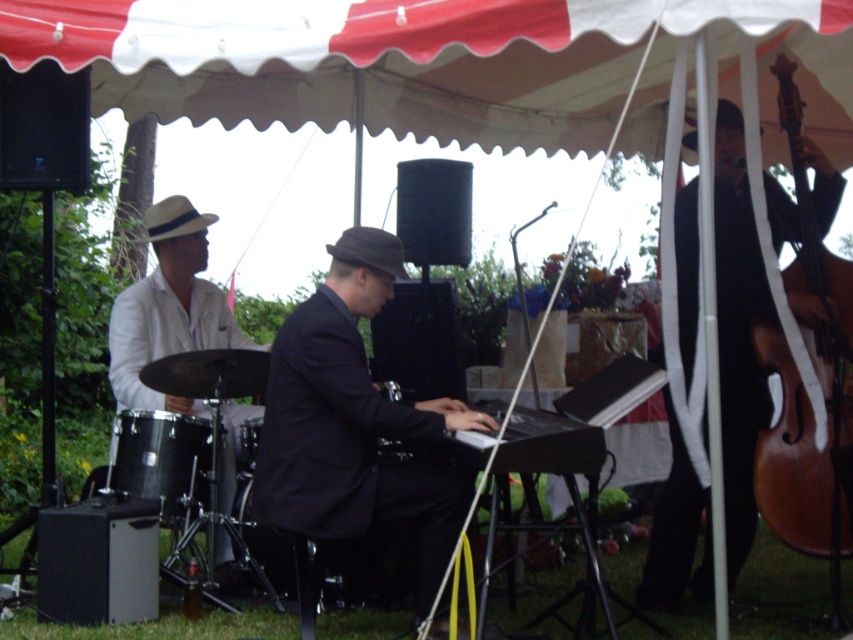
Consider the image. Is white matte suit at left shorter than black drum at lower left?

In fact, white matte suit at left may be taller than black drum at lower left.

Does point (202, 321) come in front of point (283, 532)?

No, it is behind (283, 532).

Between point (196, 259) and point (241, 499), which one is positioned behind?

Positioned behind is point (196, 259).

Locate an element on the screen. The width and height of the screenshot is (853, 640). white matte suit at left is located at coordinates (169, 308).

Is beige felt fedora at left smaller than black drum at center?

Incorrect, beige felt fedora at left is not smaller in size than black drum at center.

Who is more forward, [167,218] or [250,468]?

Point [250,468] is more forward.

This screenshot has width=853, height=640. Describe the element at coordinates (172, 220) in the screenshot. I see `beige felt fedora at left` at that location.

The height and width of the screenshot is (640, 853). Identify the location of beige felt fedora at left. (172, 220).

Which is more to the left, brown wooden violin at right or beige felt fedora at left?

From the viewer's perspective, beige felt fedora at left appears more on the left side.

Is point (804, 417) behind point (171, 221)?

No, it is in front of (171, 221).

This screenshot has width=853, height=640. Identify the location of brown wooden violin at right. (799, 380).